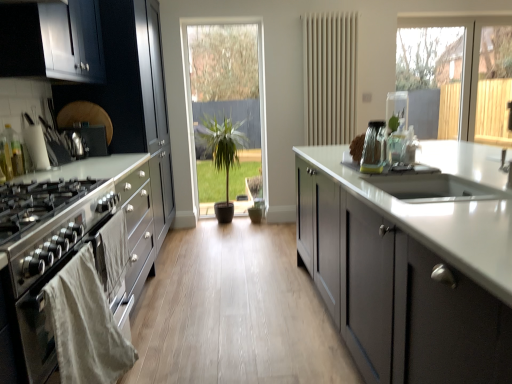
Question: Is green matte plant at center aimed at matte gray cabinets at center, which is counted as the 2th cabinetry, starting from the left?

Choices:
 (A) no
 (B) yes

Answer: (A)

Question: Is green matte plant at center at the left side of matte gray cabinets at center, the 1th cabinetry when ordered from right to left?

Choices:
 (A) no
 (B) yes

Answer: (B)

Question: Can you confirm if green matte plant at center is bigger than matte gray cabinets at center, which is counted as the 2th cabinetry, starting from the left?

Choices:
 (A) yes
 (B) no

Answer: (B)

Question: Would you say green matte plant at center is outside matte gray cabinets at center, the 1th cabinetry when ordered from right to left?

Choices:
 (A) no
 (B) yes

Answer: (B)

Question: From a real-world perspective, does green matte plant at center stand above matte gray cabinets at center, which is counted as the 2th cabinetry, starting from the left?

Choices:
 (A) no
 (B) yes

Answer: (B)

Question: Does green matte plant at center have a lesser height compared to matte gray cabinets at center, the 1th cabinetry when ordered from right to left?

Choices:
 (A) yes
 (B) no

Answer: (B)

Question: From the image's perspective, would you say satin silver knife block at left, the 2th appliance in the front-to-back sequence, is positioned over stainless steel oven at left?

Choices:
 (A) yes
 (B) no

Answer: (A)

Question: From a real-world perspective, is satin silver knife block at left, which appears as the 1th appliance when viewed from the left, physically above stainless steel oven at left?

Choices:
 (A) yes
 (B) no

Answer: (A)

Question: Can you confirm if satin silver knife block at left, the 2th appliance in the front-to-back sequence, is wider than stainless steel oven at left?

Choices:
 (A) yes
 (B) no

Answer: (B)

Question: Is the depth of satin silver knife block at left, the 2th appliance when ordered from right to left, less than that of stainless steel oven at left?

Choices:
 (A) yes
 (B) no

Answer: (B)

Question: Considering the relative sizes of satin silver knife block at left, which appears as the 1th appliance when viewed from the left, and stainless steel oven at left in the image provided, is satin silver knife block at left, which appears as the 1th appliance when viewed from the left, taller than stainless steel oven at left?

Choices:
 (A) yes
 (B) no

Answer: (B)

Question: Is satin silver knife block at left, the 1th appliance when ordered from back to front, oriented towards stainless steel oven at left?

Choices:
 (A) no
 (B) yes

Answer: (A)

Question: Considering the relative sizes of beige matte radiator at center and satin black cabinets at left, the first cabinetry positioned from the left, in the image provided, is beige matte radiator at center wider than satin black cabinets at left, the first cabinetry positioned from the left,?

Choices:
 (A) no
 (B) yes

Answer: (A)